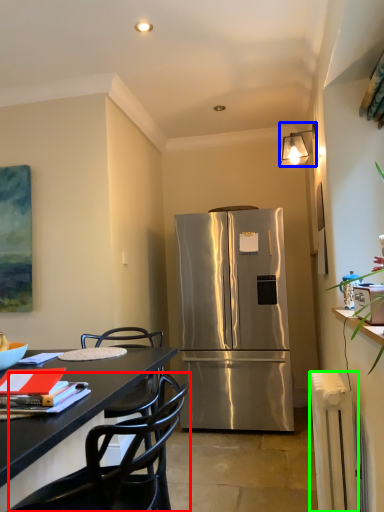
Question: Which object is the closest to the chair (highlighted by a red box)? Choose among these: lamp (highlighted by a blue box) or radiator (highlighted by a green box).

Choices:
 (A) lamp
 (B) radiator

Answer: (B)